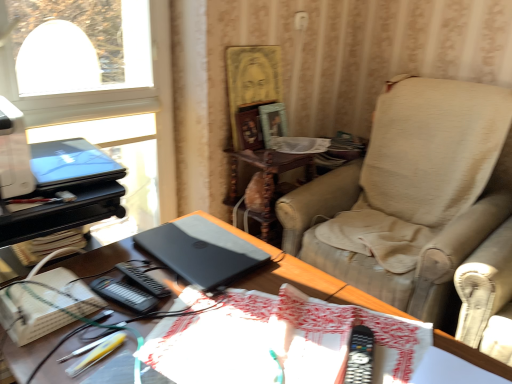
Identify the location of vacant space that's between white cardboard book at lower left and black plastic remote control at lower right. (196, 342).